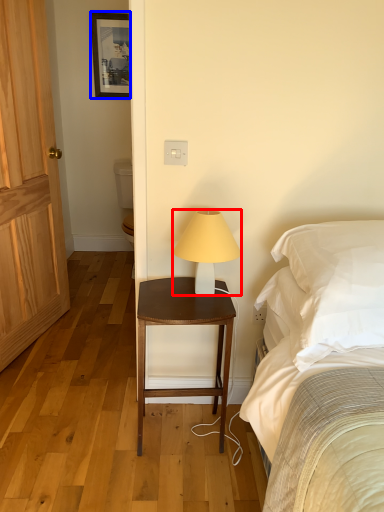
Question: Which point is closer to the camera, lamp (highlighted by a red box) or picture frame (highlighted by a blue box)?

Choices:
 (A) lamp
 (B) picture frame

Answer: (A)